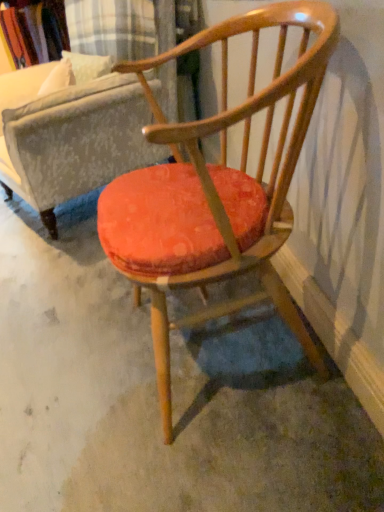
Question: Is orange fabric cushion at center oriented away from wooden armchair at center?

Choices:
 (A) no
 (B) yes

Answer: (A)

Question: From a real-world perspective, does orange fabric cushion at center sit lower than wooden armchair at center?

Choices:
 (A) no
 (B) yes

Answer: (B)

Question: From a real-world perspective, is orange fabric cushion at center located higher than wooden armchair at center?

Choices:
 (A) no
 (B) yes

Answer: (A)

Question: Is wooden armchair at center located within orange fabric cushion at center?

Choices:
 (A) yes
 (B) no

Answer: (B)

Question: Can you confirm if orange fabric cushion at center is wider than wooden armchair at center?

Choices:
 (A) no
 (B) yes

Answer: (B)

Question: Is orange fabric cushion at center at the left side of wooden armchair at center?

Choices:
 (A) yes
 (B) no

Answer: (A)

Question: From a real-world perspective, is velvet orange cushion at center over orange fabric cushion at center?

Choices:
 (A) no
 (B) yes

Answer: (B)

Question: Considering the relative sizes of velvet orange cushion at center and orange fabric cushion at center in the image provided, is velvet orange cushion at center thinner than orange fabric cushion at center?

Choices:
 (A) yes
 (B) no

Answer: (A)

Question: Considering the relative sizes of velvet orange cushion at center and orange fabric cushion at center in the image provided, is velvet orange cushion at center shorter than orange fabric cushion at center?

Choices:
 (A) yes
 (B) no

Answer: (B)

Question: Is orange fabric cushion at center located within velvet orange cushion at center?

Choices:
 (A) no
 (B) yes

Answer: (A)

Question: Is velvet orange cushion at center not close to orange fabric cushion at center?

Choices:
 (A) no
 (B) yes

Answer: (A)

Question: Is velvet orange cushion at center positioned before orange fabric cushion at center?

Choices:
 (A) yes
 (B) no

Answer: (B)

Question: Can you confirm if wooden armchair at center is wider than orange fabric cushion at center?

Choices:
 (A) no
 (B) yes

Answer: (A)